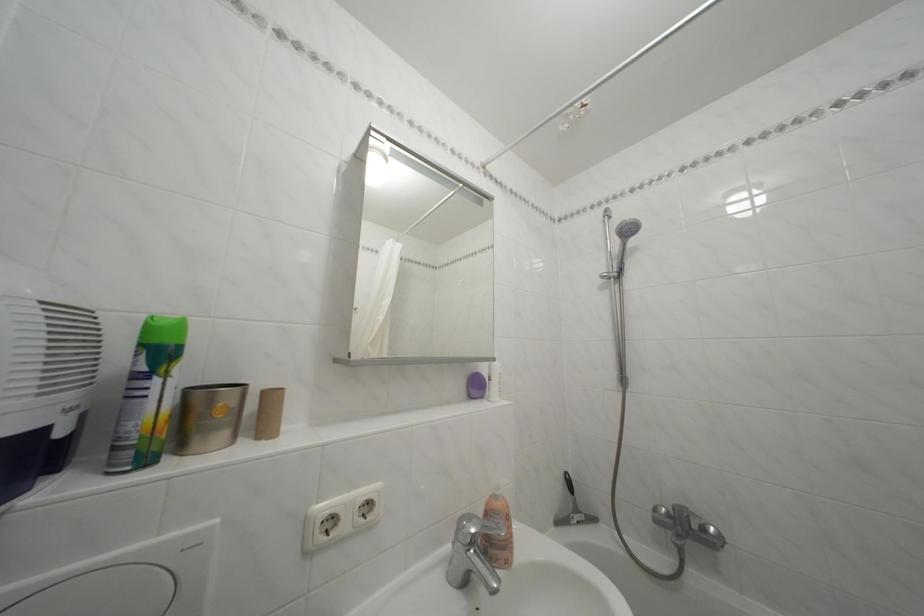
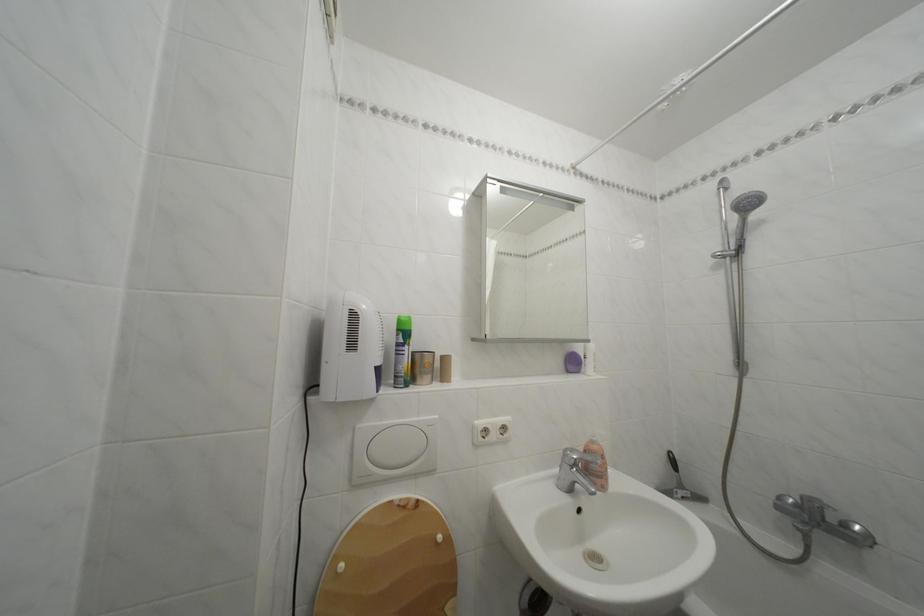
In the second image, find the point that corresponds to point 618,224 in the first image.

(736, 195)